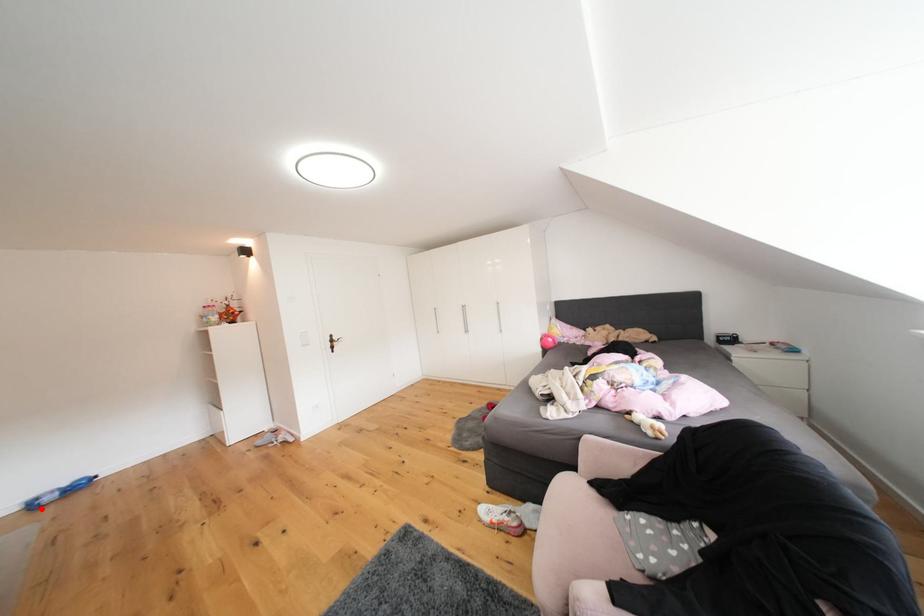
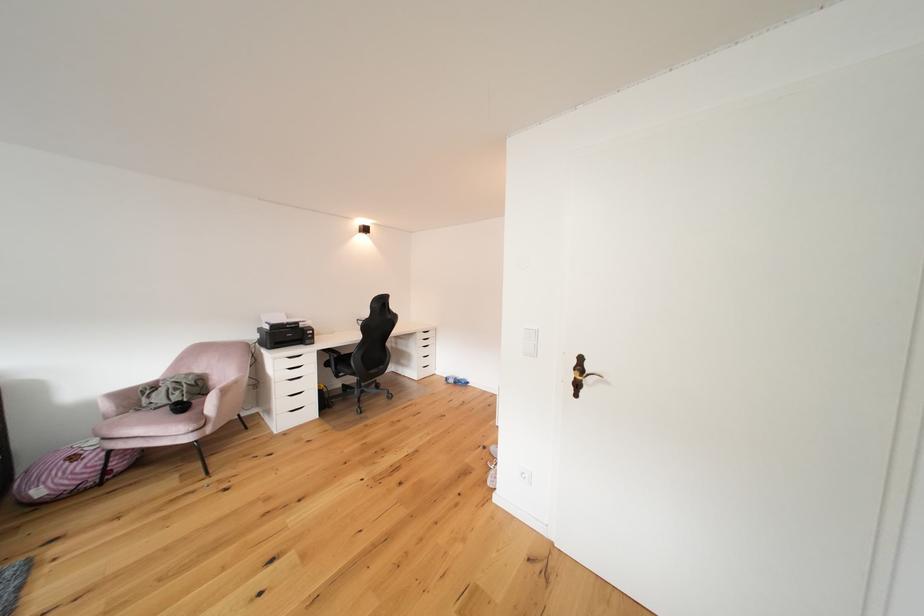
Question: I am providing you with two images of the same scene from different viewpoints. Image1 has a red point marked. In image2, the corresponding 3D location appears at what relative position? Reply with the corresponding letter.

Choices:
 (A) Closer
 (B) Farther

Answer: (A)